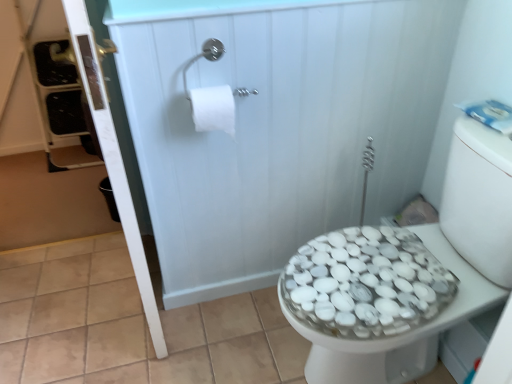
Locate an element on the screen. Image resolution: width=512 pixels, height=384 pixels. free space to the left of white glossy shower door at upper left is located at coordinates (131, 312).